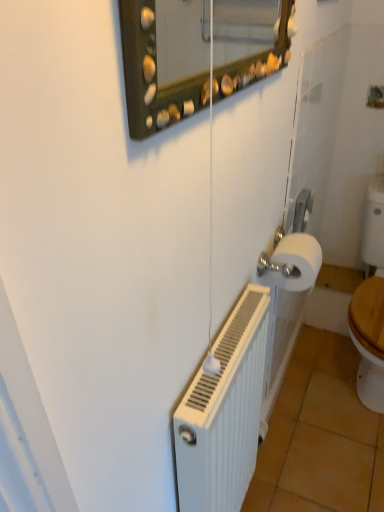
Question: Should I look upward or downward to see white ribbed radiator at lower right?

Choices:
 (A) up
 (B) down

Answer: (B)

Question: From a real-world perspective, is white matte toilet paper at right positioned over white ribbed radiator at lower right based on gravity?

Choices:
 (A) yes
 (B) no

Answer: (A)

Question: Considering the relative positions of white matte toilet paper at right and white ribbed radiator at lower right in the image provided, is white matte toilet paper at right to the right of white ribbed radiator at lower right from the viewer's perspective?

Choices:
 (A) no
 (B) yes

Answer: (B)

Question: Is white matte toilet paper at right at the left side of white ribbed radiator at lower right?

Choices:
 (A) yes
 (B) no

Answer: (B)

Question: Does white matte toilet paper at right lie in front of white ribbed radiator at lower right?

Choices:
 (A) no
 (B) yes

Answer: (A)

Question: From the image's perspective, would you say white matte toilet paper at right is positioned over white ribbed radiator at lower right?

Choices:
 (A) yes
 (B) no

Answer: (A)

Question: Is white matte toilet paper at right thinner than white ribbed radiator at lower right?

Choices:
 (A) yes
 (B) no

Answer: (B)

Question: Is white matte toilet paper at right turned away from orange tile at lower right?

Choices:
 (A) no
 (B) yes

Answer: (A)

Question: Is white matte toilet paper at right facing towards orange tile at lower right?

Choices:
 (A) no
 (B) yes

Answer: (A)

Question: Is white matte toilet paper at right completely or partially outside of orange tile at lower right?

Choices:
 (A) yes
 (B) no

Answer: (A)

Question: Is white matte toilet paper at right not close to orange tile at lower right?

Choices:
 (A) no
 (B) yes

Answer: (A)

Question: Can you confirm if white matte toilet paper at right is bigger than orange tile at lower right?

Choices:
 (A) yes
 (B) no

Answer: (B)

Question: Is white matte toilet paper at right in contact with orange tile at lower right?

Choices:
 (A) no
 (B) yes

Answer: (A)

Question: From a real-world perspective, does orange tile at lower right stand above white ribbed radiator at lower right?

Choices:
 (A) yes
 (B) no

Answer: (B)